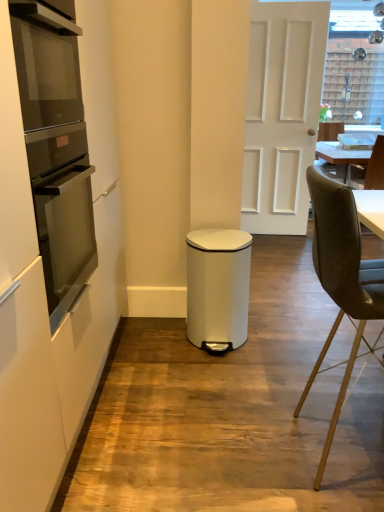
Question: Does matte black oven at left have a lesser height compared to white matte door at center?

Choices:
 (A) no
 (B) yes

Answer: (B)

Question: Can you confirm if matte black oven at left is positioned to the left of white matte door at center?

Choices:
 (A) no
 (B) yes

Answer: (B)

Question: Could you tell me if matte black oven at left is facing white matte door at center?

Choices:
 (A) yes
 (B) no

Answer: (B)

Question: Is the position of matte black oven at left less distant than that of white matte door at center?

Choices:
 (A) yes
 (B) no

Answer: (A)

Question: Does matte black oven at left have a greater height compared to white matte door at center?

Choices:
 (A) yes
 (B) no

Answer: (B)

Question: From the image's perspective, is matte black oven at left located beneath white matte door at center?

Choices:
 (A) yes
 (B) no

Answer: (A)

Question: Can you confirm if white matte door at center is positioned to the right of white matte waste bin at center?

Choices:
 (A) yes
 (B) no

Answer: (A)

Question: Are white matte door at center and white matte waste bin at center located far from each other?

Choices:
 (A) yes
 (B) no

Answer: (A)

Question: From a real-world perspective, is white matte door at center physically below white matte waste bin at center?

Choices:
 (A) no
 (B) yes

Answer: (A)

Question: Is white matte waste bin at center located within white matte door at center?

Choices:
 (A) no
 (B) yes

Answer: (A)

Question: Is white matte door at center completely or partially outside of white matte waste bin at center?

Choices:
 (A) yes
 (B) no

Answer: (A)

Question: Is white matte door at center next to white matte waste bin at center?

Choices:
 (A) yes
 (B) no

Answer: (B)

Question: Can you confirm if white matte waste bin at center is smaller than black leather chair at right, acting as the second chair starting from the front?

Choices:
 (A) yes
 (B) no

Answer: (A)